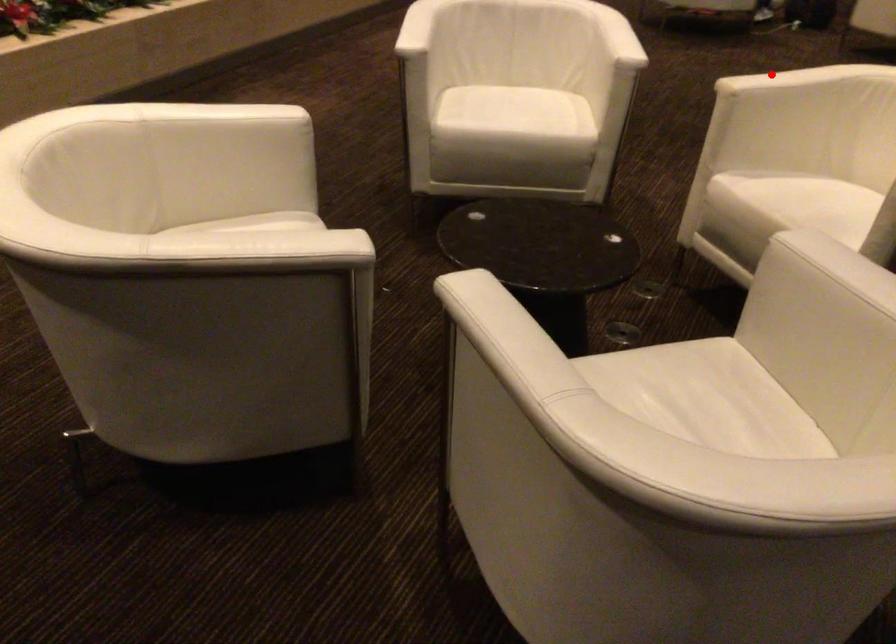
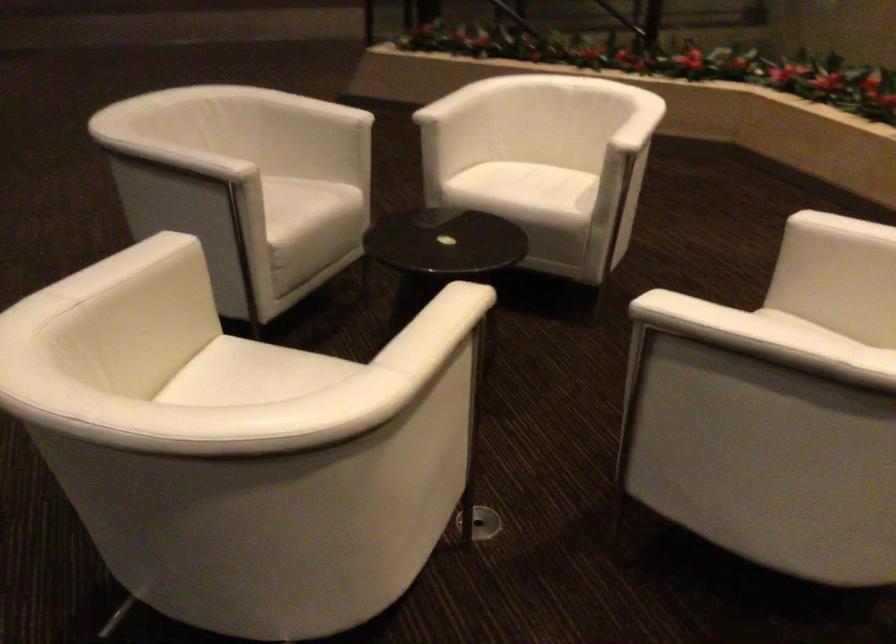
Locate, in the second image, the point that corresponds to the highlighted location in the first image.

(437, 308)